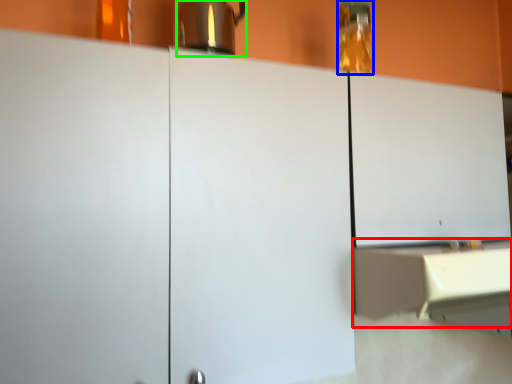
Question: Which object is the closest to the counter (highlighted by a red box)? Choose among these: bottle (highlighted by a blue box) or coffeepot (highlighted by a green box).

Choices:
 (A) bottle
 (B) coffeepot

Answer: (A)